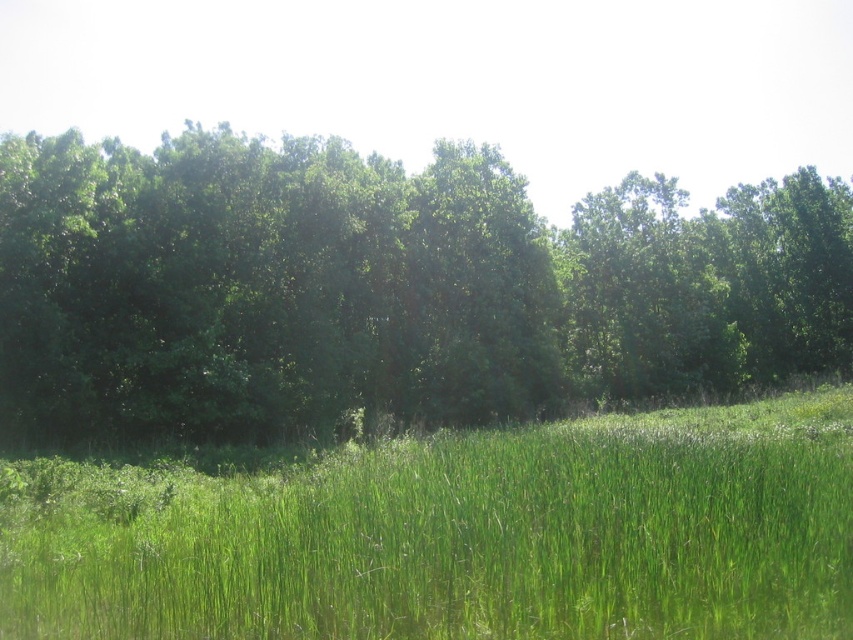
You are a hiker standing at the edge of the green grassy pasture at lower center. You want to take a photo of the green leafy trees at center. Which direction should you face to capture them in your view?

The green leafy trees at center are positioned in the center of the image, so you should face towards the center to capture them in your view.

Based on the provided scene description, where is the green leafy trees at center located in terms of 2D coordinates?

The green leafy trees at center are located at the 2D coordinates point of (386, 288).